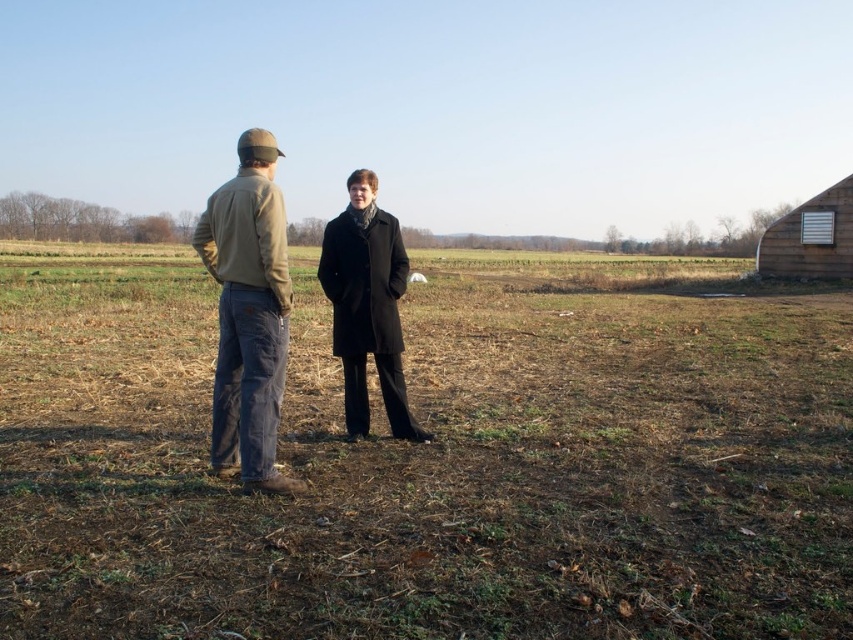
Is khaki cotton jacket at center to the right of wooden barn at right from the viewer's perspective?

In fact, khaki cotton jacket at center is to the left of wooden barn at right.

Which of these two, khaki cotton jacket at center or wooden barn at right, stands shorter?

Standing shorter between the two is khaki cotton jacket at center.

Identify the location of khaki cotton jacket at center. (248, 314).

In order to click on khaki cotton jacket at center in this screenshot , I will do `click(248, 314)`.

Can you confirm if brown grass at center is shorter than wooden barn at right?

Indeed, brown grass at center has a lesser height compared to wooden barn at right.

Between point (212, 328) and point (778, 241), which one is positioned behind?

Point (778, 241)

At what (x,y) coordinates should I click in order to perform the action: click on brown grass at center. Please return your answer as a coordinate pair (x, y). Image resolution: width=853 pixels, height=640 pixels. Looking at the image, I should click on (428, 460).

Between brown grass at center and khaki cotton jacket at center, which one is positioned higher?

Positioned higher is brown grass at center.

Is point (572, 612) positioned after point (254, 337)?

No.

This screenshot has width=853, height=640. I want to click on brown grass at center, so click(428, 460).